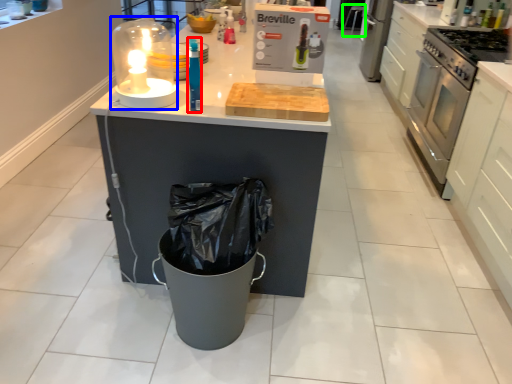
Question: Which object is positioned farthest from bottle (highlighted by a red box)? Select from candle holder (highlighted by a blue box) and bar stool (highlighted by a green box).

Choices:
 (A) candle holder
 (B) bar stool

Answer: (B)